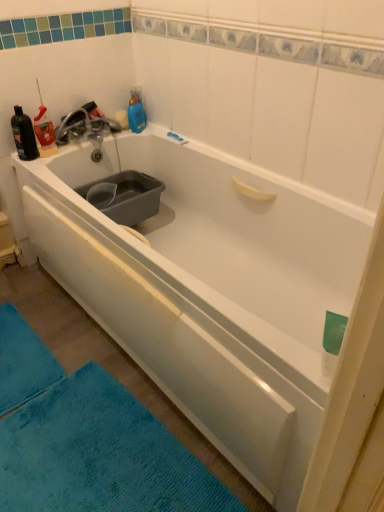
The image size is (384, 512). I want to click on empty space that is ontop of blue soft bath mat at lower left (from a real-world perspective), so click(x=13, y=350).